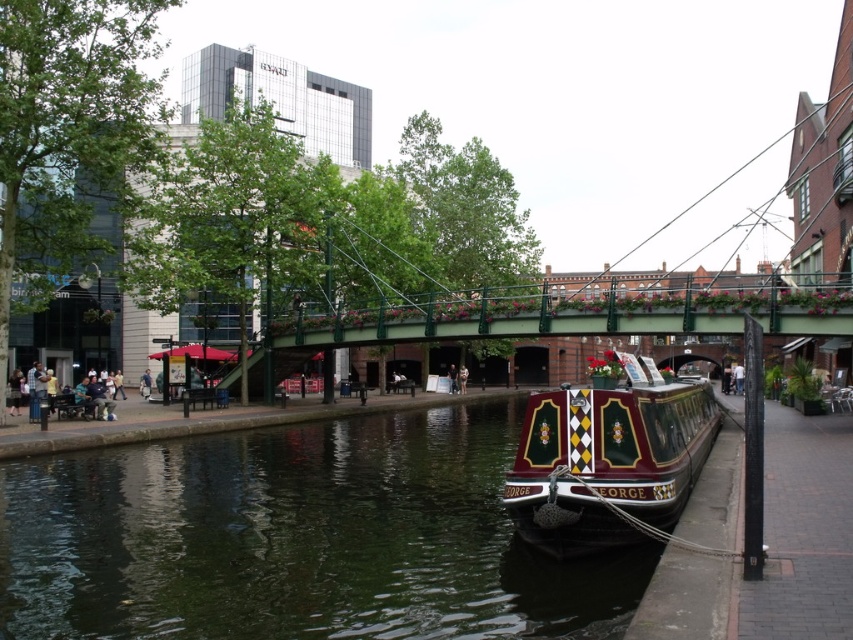
Question: Which of the following is the farthest from the observer?

Choices:
 (A) polished dark wood barge at lower right
 (B) green smooth water at lower center

Answer: (A)

Question: Does green smooth water at lower center appear on the left side of polished dark wood barge at lower right?

Choices:
 (A) no
 (B) yes

Answer: (B)

Question: Is green smooth water at lower center smaller than polished dark wood barge at lower right?

Choices:
 (A) no
 (B) yes

Answer: (A)

Question: From the image, what is the correct spatial relationship of green smooth water at lower center in relation to polished dark wood barge at lower right?

Choices:
 (A) left
 (B) right

Answer: (A)